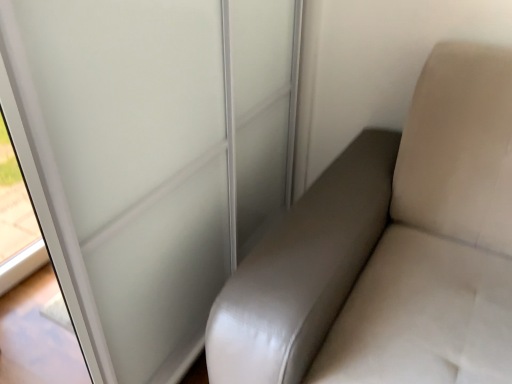
Find the location of a particular element. The height and width of the screenshot is (384, 512). satin beige sofa at right is located at coordinates (390, 250).

Measure the distance between point (230, 334) and camera.

Point (230, 334) is 31.10 inches from camera.

What do you see at coordinates (390, 250) in the screenshot?
I see `satin beige sofa at right` at bounding box center [390, 250].

Locate an element on the screen. This screenshot has width=512, height=384. satin beige sofa at right is located at coordinates (390, 250).